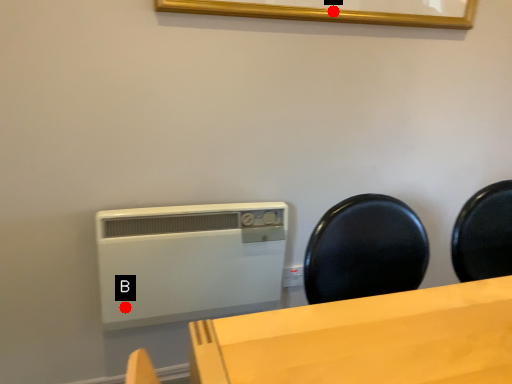
Question: Two points are circled on the image, labeled by A and B beside each circle. Which point is farther from the camera taking this photo?

Choices:
 (A) A is further
 (B) B is further

Answer: (B)